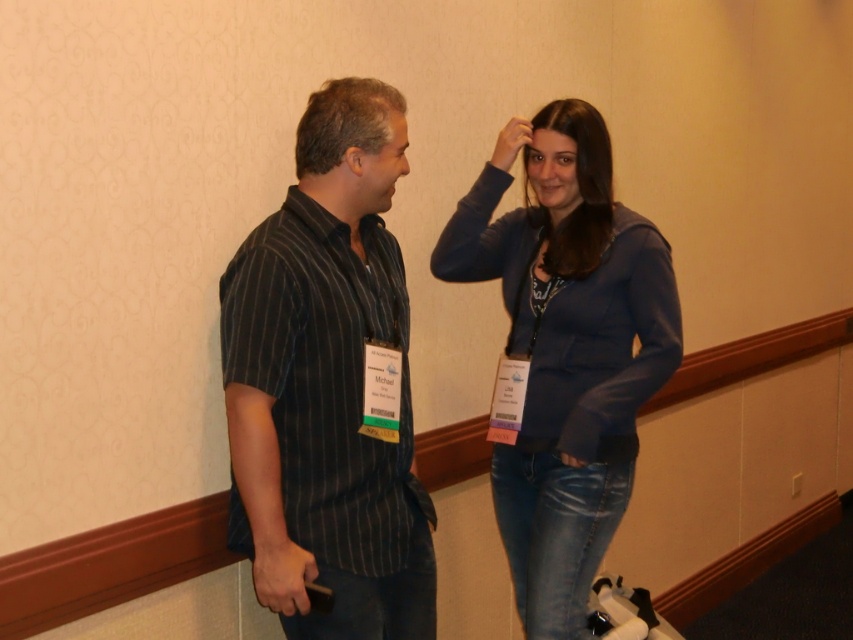
Question: Which point appears closest to the camera in this image?

Choices:
 (A) (616, 292)
 (B) (538, 147)
 (C) (241, 381)

Answer: (C)

Question: Does striped cotton shirt at center have a greater width compared to matte blue hoodie at center?

Choices:
 (A) yes
 (B) no

Answer: (B)

Question: Which of the following is the closest to the observer?

Choices:
 (A) (535, 429)
 (B) (502, 131)

Answer: (A)

Question: Does matte blue hoodie at center have a larger size compared to matte skin forehead at upper center?

Choices:
 (A) yes
 (B) no

Answer: (A)

Question: Which of the following is the closest to the observer?

Choices:
 (A) (595, 536)
 (B) (526, 138)

Answer: (A)

Question: Is striped cotton shirt at center in front of matte blue hand at upper center?

Choices:
 (A) yes
 (B) no

Answer: (A)